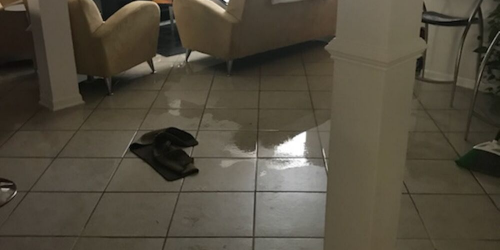
This screenshot has width=500, height=250. In order to click on wet side of floor in this screenshot , I will do tap(286, 135), tap(248, 141), tap(294, 113), tap(288, 102), tap(236, 101), tap(228, 83), tap(294, 77).